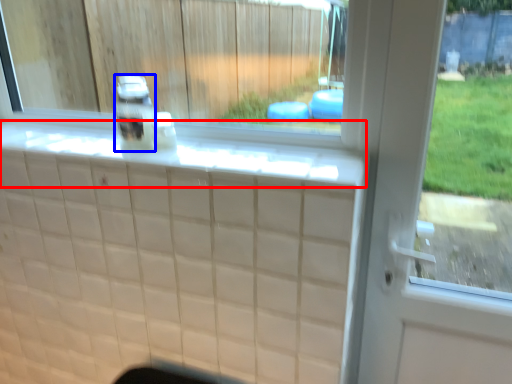
Question: Among these objects, which one is farthest to the camera, ledge (highlighted by a red box) or bottle (highlighted by a blue box)?

Choices:
 (A) ledge
 (B) bottle

Answer: (B)